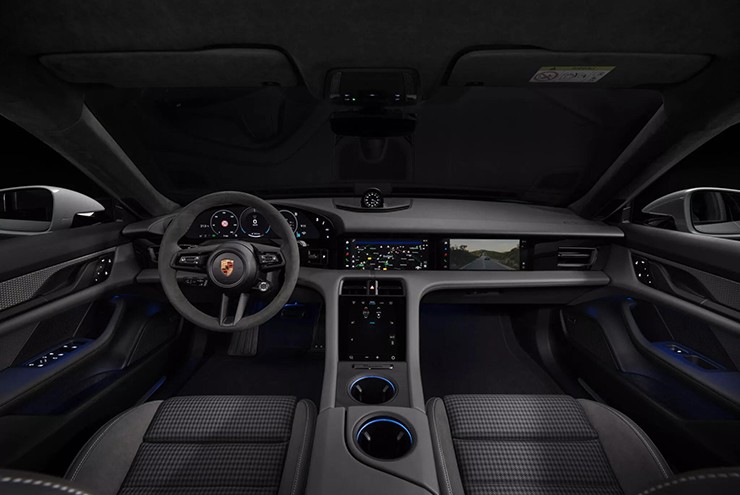
Image resolution: width=740 pixels, height=495 pixels. Identify the location of left door. (58, 383).